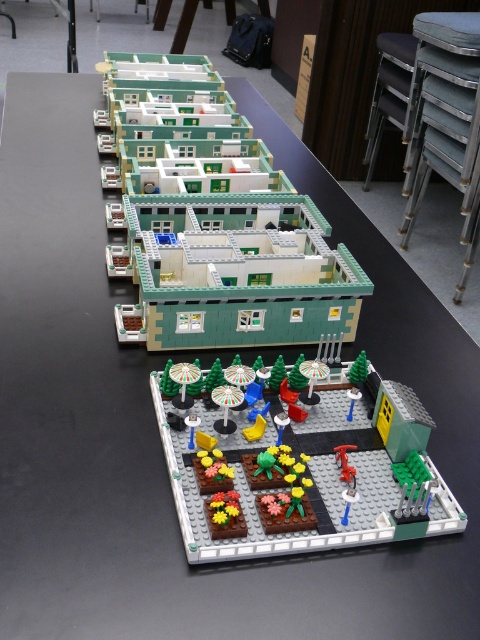
Is point (433, 509) positioned after point (364, 156)?

No, it is in front of (364, 156).

What do you see at coordinates (308, 476) in the screenshot?
I see `brick-patterned garden at center` at bounding box center [308, 476].

Where is `brick-patterned garden at center`? The width and height of the screenshot is (480, 640). brick-patterned garden at center is located at coordinates (308, 476).

This screenshot has height=640, width=480. I want to click on brick-patterned garden at center, so click(x=308, y=476).

Is metallic gold stool at upper right positioned in front of metallic red fire hydrant at center?

No, metallic gold stool at upper right is further to the viewer.

Locate an element on the screen. metallic gold stool at upper right is located at coordinates (388, 92).

Does green matte building at upper center appear over metallic red fire hydrant at center?

Indeed, green matte building at upper center is positioned over metallic red fire hydrant at center.

Between green matte building at upper center and metallic red fire hydrant at center, which one is positioned lower?

metallic red fire hydrant at center

Does point (300, 244) come farther from viewer compared to point (335, 451)?

Yes, it is.

Image resolution: width=480 pixels, height=640 pixels. In order to click on green matte building at upper center in this screenshot , I will do `click(228, 248)`.